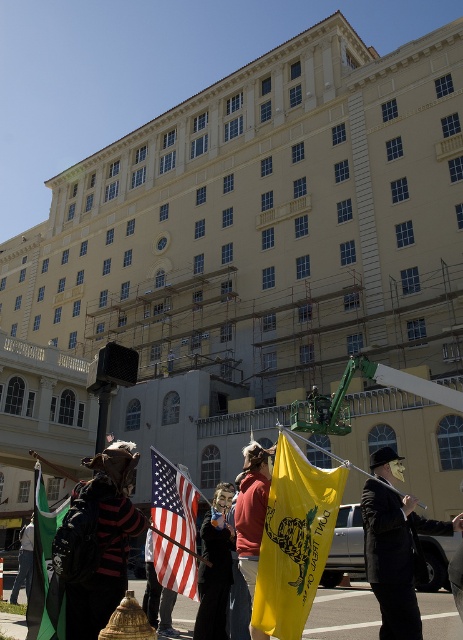
Is matte black mask at center smaller than reddish-brown leather jacket at center?

Indeed, matte black mask at center has a smaller size compared to reddish-brown leather jacket at center.

Does matte black mask at center appear on the right side of reddish-brown leather jacket at center?

Incorrect, matte black mask at center is not on the right side of reddish-brown leather jacket at center.

Which is in front, point (200, 592) or point (263, 486)?

Positioned in front is point (200, 592).

Identify the location of matte black mask at center. The image size is (463, 640). (214, 568).

Based on the photo, does yellow fabric flag at center have a lesser height compared to reddish-brown leather jacket at center?

Indeed, yellow fabric flag at center has a lesser height compared to reddish-brown leather jacket at center.

Does point (311, 596) come in front of point (238, 518)?

Yes, it is in front of point (238, 518).

Where is `yellow fabric flag at center`? The width and height of the screenshot is (463, 640). yellow fabric flag at center is located at coordinates (294, 540).

Between green fabric flag at lower left and reddish-brown leather jacket at center, which one has more height?

Standing taller between the two is green fabric flag at lower left.

Between green fabric flag at lower left and reddish-brown leather jacket at center, which one appears on the right side from the viewer's perspective?

reddish-brown leather jacket at center is more to the right.

I want to click on green fabric flag at lower left, so click(44, 570).